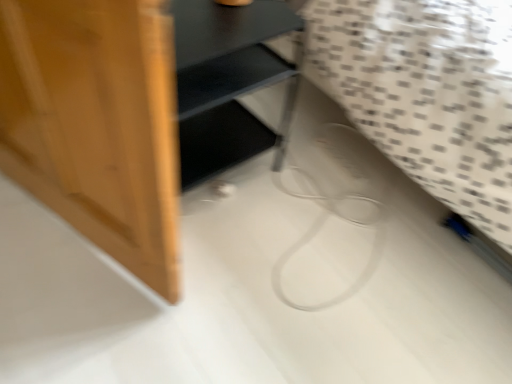
Where is `matte black shelf at center`? matte black shelf at center is located at coordinates (135, 111).

What do you see at coordinates (135, 111) in the screenshot? Image resolution: width=512 pixels, height=384 pixels. I see `matte black shelf at center` at bounding box center [135, 111].

At what (x,y) coordinates should I click in order to perform the action: click on white textured fabric at lower right. Please return your answer as a coordinate pair (x, y). The image size is (512, 384). Looking at the image, I should click on (426, 93).

What do you see at coordinates (426, 93) in the screenshot? I see `white textured fabric at lower right` at bounding box center [426, 93].

Measure the distance between point (483, 6) and camera.

Point (483, 6) and camera are 4.04 feet apart.

Locate an element on the screen. This screenshot has width=512, height=384. matte black shelf at center is located at coordinates (135, 111).

Which object is positioned more to the right, matte black shelf at center or white textured fabric at lower right?

From the viewer's perspective, white textured fabric at lower right appears more on the right side.

Is matte black shelf at center closer to camera compared to white textured fabric at lower right?

No, matte black shelf at center is further to the viewer.

Which point is more distant from viewer, (109, 113) or (470, 66)?

Point (470, 66)

From the image's perspective, is matte black shelf at center located above white textured fabric at lower right?

Incorrect, from the image's perspective, matte black shelf at center is lower than white textured fabric at lower right.

From a real-world perspective, who is located lower, matte black shelf at center or white textured fabric at lower right?

matte black shelf at center.

Which object is thinner, matte black shelf at center or white textured fabric at lower right?

With smaller width is matte black shelf at center.

Does matte black shelf at center have a lesser height compared to white textured fabric at lower right?

Indeed, matte black shelf at center has a lesser height compared to white textured fabric at lower right.

Does matte black shelf at center have a larger size compared to white textured fabric at lower right?

No.

Is matte black shelf at center not inside white textured fabric at lower right?

That's correct, matte black shelf at center is outside of white textured fabric at lower right.

Are matte black shelf at center and white textured fabric at lower right located far from each other?

matte black shelf at center is near white textured fabric at lower right, not far away.

Is matte black shelf at center facing towards white textured fabric at lower right?

No, matte black shelf at center does not turn towards white textured fabric at lower right.

How many degrees apart are the facing directions of matte black shelf at center and white textured fabric at lower right?

They differ by 2.98 degrees in their facing directions.

Image resolution: width=512 pixels, height=384 pixels. I want to click on sheet to the right of matte black shelf at center, so click(426, 93).

In the image, is white textured fabric at lower right on the left side or the right side of matte black shelf at center?

Based on their positions, white textured fabric at lower right is located to the right of matte black shelf at center.

Between white textured fabric at lower right and matte black shelf at center, which one is positioned behind?

matte black shelf at center is further away from the camera.

Which point is more forward, (x=447, y=111) or (x=59, y=158)?

The point (x=59, y=158) is more forward.

From the image's perspective, would you say white textured fabric at lower right is shown under matte black shelf at center?

No, from the image's perspective, white textured fabric at lower right is not below matte black shelf at center.

From a real-world perspective, is white textured fabric at lower right physically below matte black shelf at center?

No, from a real-world perspective, white textured fabric at lower right is not below matte black shelf at center.

Can you confirm if white textured fabric at lower right is thinner than matte black shelf at center?

No, white textured fabric at lower right is not thinner than matte black shelf at center.

Which of these two, white textured fabric at lower right or matte black shelf at center, stands shorter?

matte black shelf at center.

Considering the sizes of objects white textured fabric at lower right and matte black shelf at center in the image provided, who is bigger, white textured fabric at lower right or matte black shelf at center?

white textured fabric at lower right.

Do you think white textured fabric at lower right is within matte black shelf at center, or outside of it?

white textured fabric at lower right exists outside the volume of matte black shelf at center.

Is white textured fabric at lower right not close to matte black shelf at center?

No, there isn't a large distance between white textured fabric at lower right and matte black shelf at center.

Could you tell me if white textured fabric at lower right is facing matte black shelf at center?

No, white textured fabric at lower right is not facing towards matte black shelf at center.

What's the angular difference between white textured fabric at lower right and matte black shelf at center's facing directions?

2.98 degrees.

Identify the location of furniture on the left of the white textured fabric at lower right. coord(135,111).

At what (x,y) coordinates should I click in order to perform the action: click on sheet that appears on the right of matte black shelf at center. Please return your answer as a coordinate pair (x, y). Looking at the image, I should click on (426, 93).

At what (x,y) coordinates should I click in order to perform the action: click on furniture behind the white textured fabric at lower right. Please return your answer as a coordinate pair (x, y). This screenshot has height=384, width=512. Looking at the image, I should click on (135, 111).